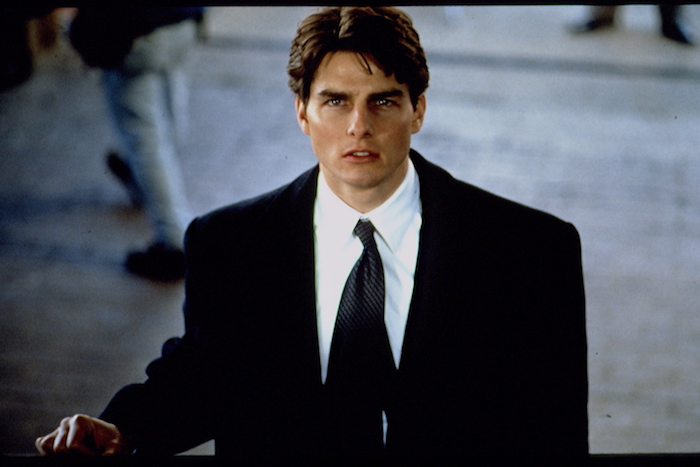
Find the location of a particular element. floor to the left is located at coordinates coord(94,330).